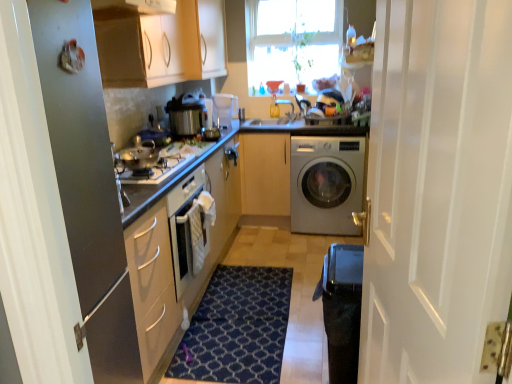
Question: Considering their positions, is dark blue textured rug at center located in front of or behind black textured water heater at lower right?

Choices:
 (A) behind
 (B) front

Answer: (A)

Question: Which is correct: dark blue textured rug at center is inside black textured water heater at lower right, or outside of it?

Choices:
 (A) inside
 (B) outside

Answer: (B)

Question: Based on their relative distances, which object is farther from the matte white cabinet at upper center, which is counted as the second cabinetry, starting from the right?

Choices:
 (A) black plastic door handle at center
 (B) shiny silver gas stove at center left
 (C) clear glass window at upper center
 (D) dark blue textured rug at center
 (E) smooth granite countertop at center

Answer: (D)

Question: Which object is positioned farthest from the shiny metallic pan at center-left, which ranks as the 1th appliance in front-to-back order?

Choices:
 (A) light wood/texture cabinet at center, which is counted as the first cabinetry, starting from the right
 (B) matte white cabinet at upper center, the 2th cabinetry when ordered from bottom to top
 (C) black plastic door handle at center
 (D) shiny silver gas stove at center left
 (E) metallic silver refrigerator at left

Answer: (A)